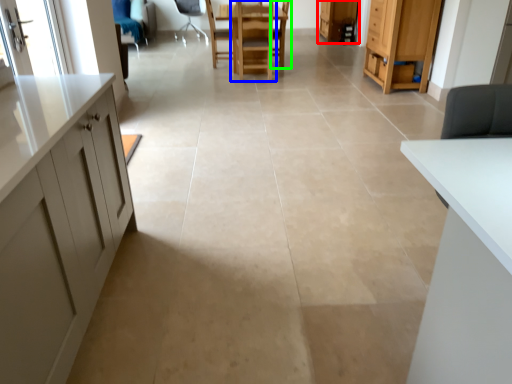
Question: Estimate the real-world distances between objects in this image. Which object is farther from cabinetry (highlighted by a red box), chair (highlighted by a blue box) or armchair (highlighted by a green box)?

Choices:
 (A) chair
 (B) armchair

Answer: (A)